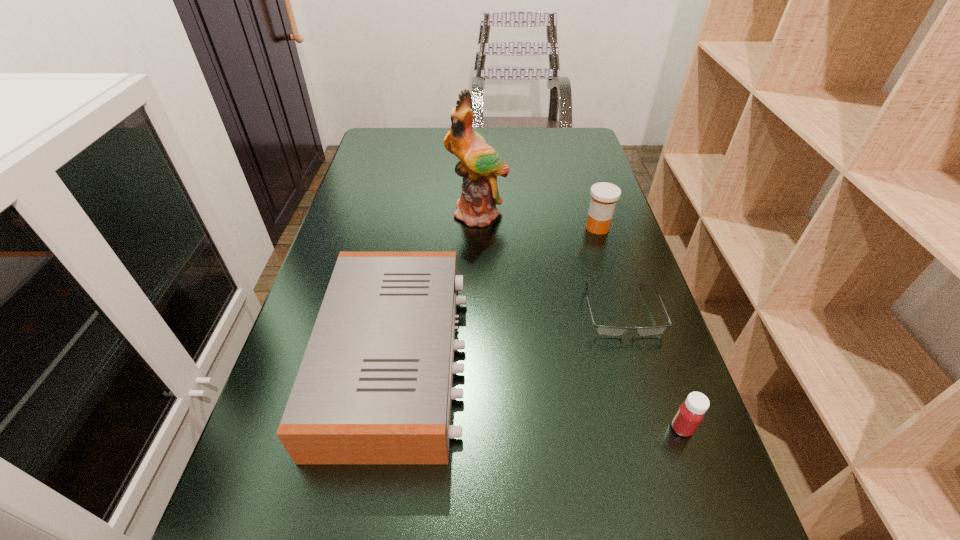
What are the coordinates of `the tallest object` in the screenshot? It's located at (479, 165).

Image resolution: width=960 pixels, height=540 pixels. Identify the location of the taller medicine. (604, 196).

Locate an element on the screen. The height and width of the screenshot is (540, 960). radio receiver is located at coordinates (374, 386).

This screenshot has width=960, height=540. I want to click on the shorter medicine, so click(690, 414).

Find the location of a particular element. This screenshot has width=960, height=540. spectacles is located at coordinates (604, 330).

Image resolution: width=960 pixels, height=540 pixels. Find the location of `free space located on the front-facing side of the parrot`. free space located on the front-facing side of the parrot is located at coordinates (477, 324).

Image resolution: width=960 pixels, height=540 pixels. I want to click on vacant space situated on the label of the taller medicine, so click(x=615, y=286).

Identify the location of vacant region located on the control panel of the radio receiver. This screenshot has height=540, width=960. (531, 359).

Identify the location of vacant space located 0.200m on the left of the shorter medicine. The height and width of the screenshot is (540, 960). (555, 428).

The width and height of the screenshot is (960, 540). Identify the location of free space located on the front-facing side of the shortest object. (x=642, y=382).